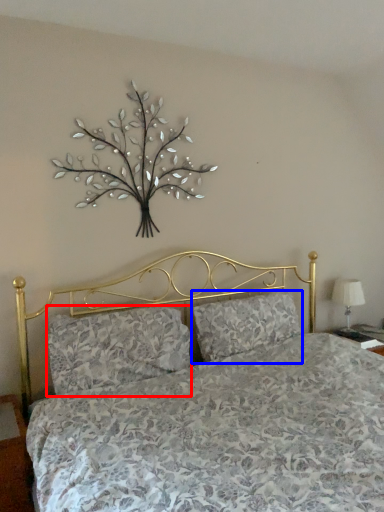
Question: Among these objects, which one is nearest to the camera, pillow (highlighted by a red box) or pillow (highlighted by a blue box)?

Choices:
 (A) pillow
 (B) pillow

Answer: (A)